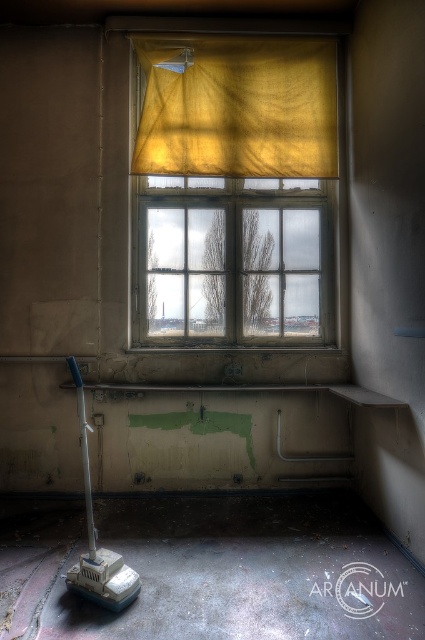
Question: Which object appears closest to the camera in this image?

Choices:
 (A) yellow sheer curtain at upper center
 (B) smooth concrete ledge at lower center
 (C) yellow fabric at center

Answer: (B)

Question: Does yellow fabric at center have a smaller size compared to yellow sheer curtain at upper center?

Choices:
 (A) yes
 (B) no

Answer: (B)

Question: Estimate the real-world distances between objects in this image. Which object is farther from the yellow sheer curtain at upper center?

Choices:
 (A) smooth concrete ledge at lower center
 (B) yellow fabric at center

Answer: (A)

Question: Considering the relative positions of yellow fabric at center and smooth concrete ledge at lower center in the image provided, where is yellow fabric at center located with respect to smooth concrete ledge at lower center?

Choices:
 (A) above
 (B) below

Answer: (A)

Question: From the image, what is the correct spatial relationship of yellow sheer curtain at upper center in relation to smooth concrete ledge at lower center?

Choices:
 (A) right
 (B) left

Answer: (A)

Question: Estimate the real-world distances between objects in this image. Which object is farther from the yellow fabric at center?

Choices:
 (A) smooth concrete ledge at lower center
 (B) yellow sheer curtain at upper center

Answer: (A)